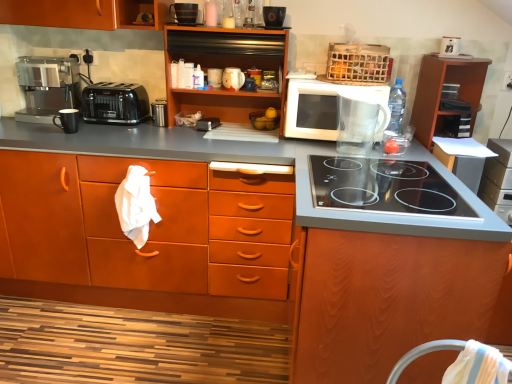
You are a GUI agent. You are given a task and a screenshot of the screen. Output one action in this format:
    pyautogui.click(x=<x>, y=<y>)
    Task: Click on the vacant area that is in front of white glossy microwave at upper center
    Image resolution: width=512 pixels, height=384 pixels.
    Given the screenshot: What is the action you would take?
    pyautogui.click(x=355, y=163)